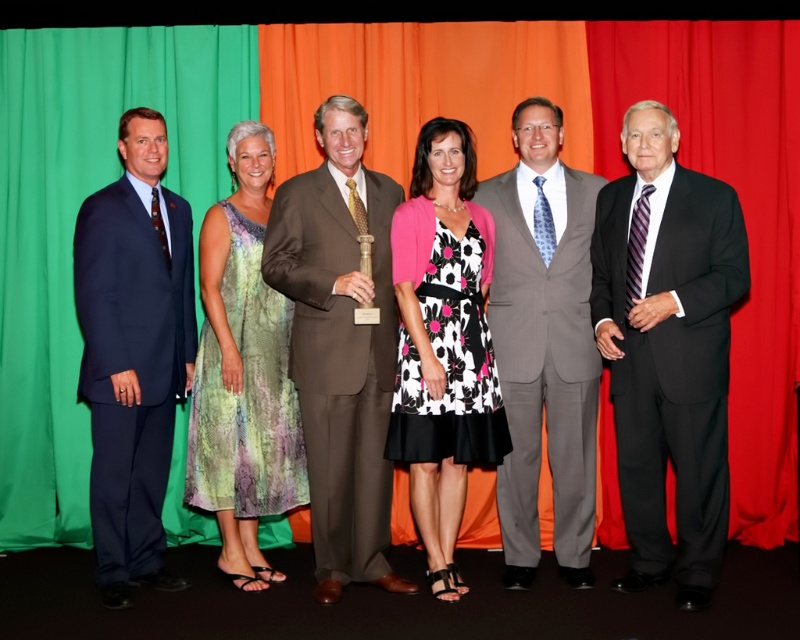
You are standing in the center of the image and want to move towards the point at coordinates (340,346). Which direction should you move to reach it?

The point at coordinates (340,346) is on the brown suit at center. Since you are already at the center, you don not need to move any direction to reach it.

From the picture: You are taking a photo of the group and want to focus on two specific points in the image. The first point is at coordinate point (x=722, y=532) and the second is at coordinate point (x=106, y=598). Which point should you focus on first if you want to ensure the closest object is in focus?

Point (x=722, y=532) is closer to the camera than point (x=106, y=598), so you should focus on point (x=722, y=532) first to ensure the closest object is in focus.